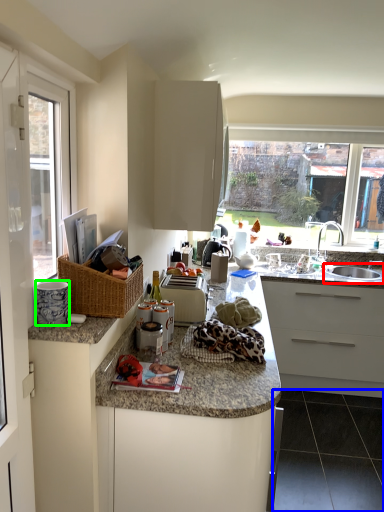
Question: Which is farther away from sink (highlighted by a red box)? tile (highlighted by a blue box) or appliance (highlighted by a green box)?

Choices:
 (A) tile
 (B) appliance

Answer: (B)